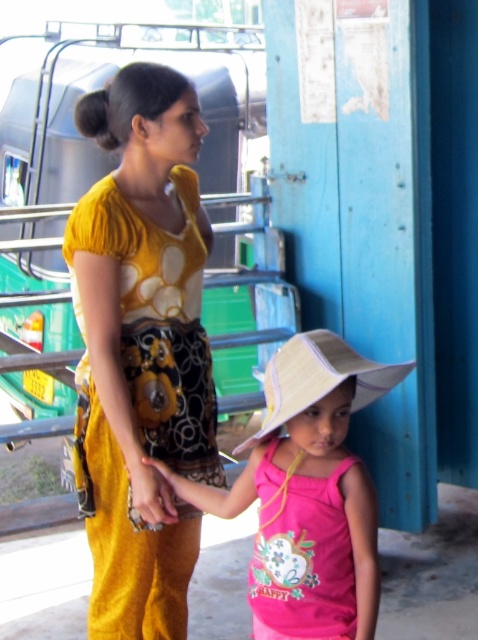
Is pink fabric dress at lower center positioned behind white woven hat at center?

Yes, pink fabric dress at lower center is behind white woven hat at center.

Is pink fabric dress at lower center thinner than white woven hat at center?

Yes.

Image resolution: width=478 pixels, height=640 pixels. Describe the element at coordinates (302, 554) in the screenshot. I see `pink fabric dress at lower center` at that location.

In order to click on pink fabric dress at lower center in this screenshot , I will do `click(302, 554)`.

Who is positioned more to the right, pink fabric hat at center or pink fabric dress at lower center?

pink fabric dress at lower center

Is pink fabric hat at center wider than pink fabric dress at lower center?

Yes.

Image resolution: width=478 pixels, height=640 pixels. What do you see at coordinates (308, 493) in the screenshot?
I see `pink fabric hat at center` at bounding box center [308, 493].

Identify the location of pink fabric hat at center. (308, 493).

Is white woven hat at center closer to camera compared to matte yellow hand at center?

Yes.

Which is in front, point (380, 371) or point (167, 484)?

Point (380, 371) is more forward.

Which is in front, point (315, 374) or point (150, 484)?

Point (315, 374) is in front.

The height and width of the screenshot is (640, 478). What are the coordinates of `white woven hat at center` in the screenshot? It's located at pos(317,378).